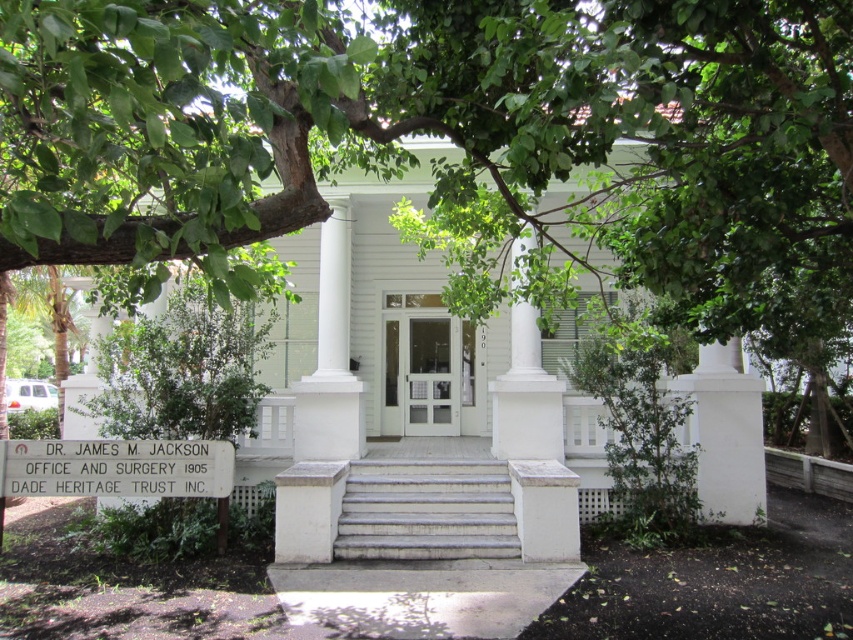
Can you confirm if white marble stairs at center is wider than white smooth column at center?

Correct, the width of white marble stairs at center exceeds that of white smooth column at center.

Does white marble stairs at center appear over white smooth column at center?

No.

The height and width of the screenshot is (640, 853). I want to click on white marble stairs at center, so click(x=426, y=512).